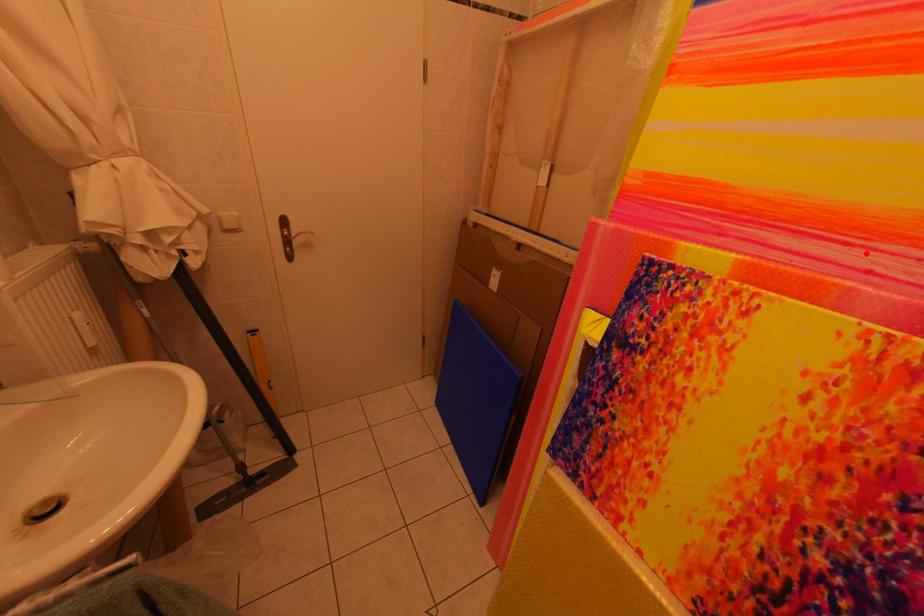
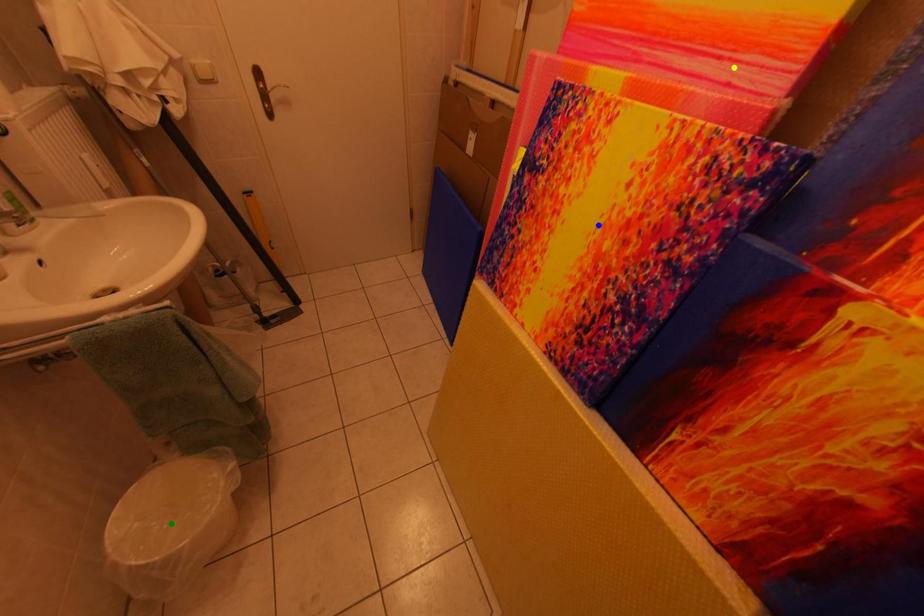
Question: I am providing you with two images of the same scene from different viewpoints. A red point is marked on the first image. You are given multiple points on the second image. Which point in image 2 represents the same 3d spot as the red point in image 1?

Choices:
 (A) yellow point
 (B) green point
 (C) blue point

Answer: (A)